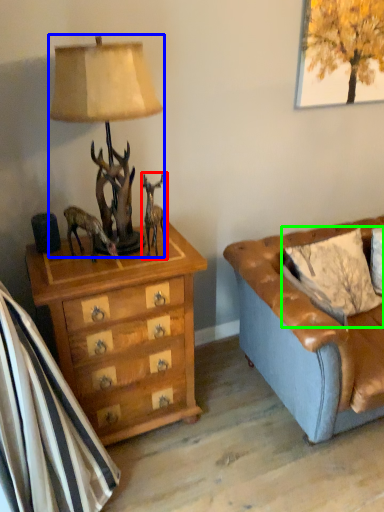
Question: Considering the real-world distances, which object is closest to reindeer (highlighted by a red box)? lamp (highlighted by a blue box) or pillow (highlighted by a green box).

Choices:
 (A) lamp
 (B) pillow

Answer: (A)